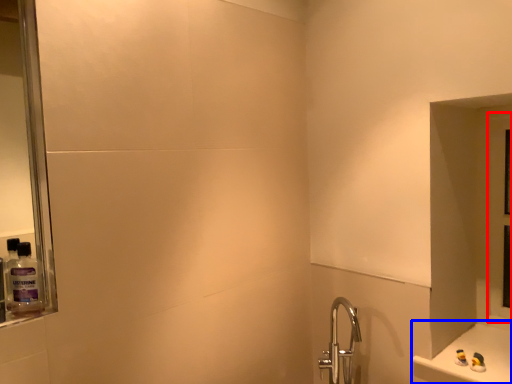
Question: Which object is closer to the camera taking this photo, glass door (highlighted by a red box) or counter (highlighted by a blue box)?

Choices:
 (A) glass door
 (B) counter

Answer: (B)